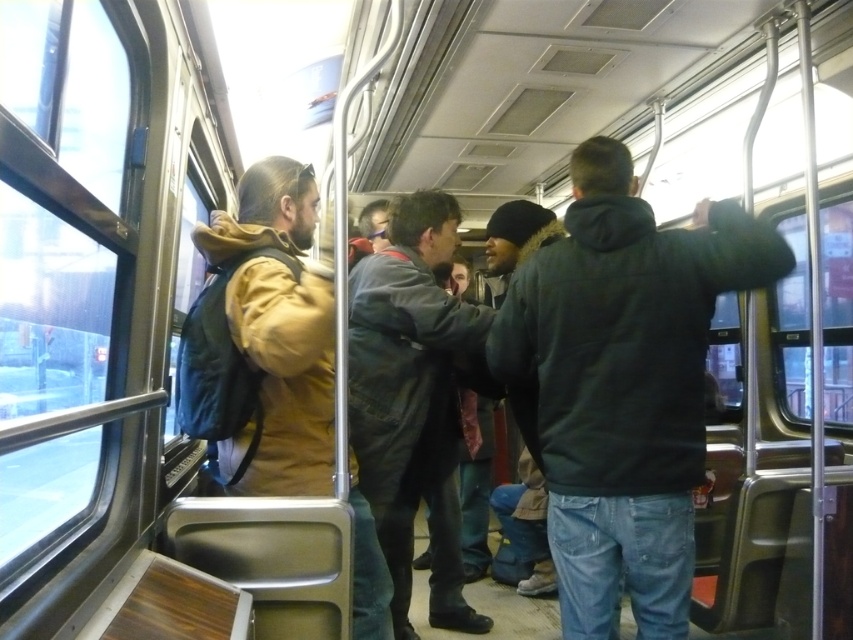
Question: Which is nearer to the brown leather jacket at left?

Choices:
 (A) dark gray hoodie at right
 (B) dark gray leather jacket at center

Answer: (B)

Question: Is dark gray hoodie at right closer to the viewer compared to dark gray leather jacket at center?

Choices:
 (A) no
 (B) yes

Answer: (B)

Question: Is dark gray hoodie at right below brown leather jacket at left?

Choices:
 (A) no
 (B) yes

Answer: (A)

Question: Which object is farther from the camera taking this photo?

Choices:
 (A) dark gray hoodie at right
 (B) brown leather jacket at left

Answer: (A)

Question: Is dark gray hoodie at right to the right of dark gray jacket at center from the viewer's perspective?

Choices:
 (A) yes
 (B) no

Answer: (A)

Question: Which point appears farthest from the camera in this image?

Choices:
 (A) (233, 460)
 (B) (560, 506)

Answer: (A)